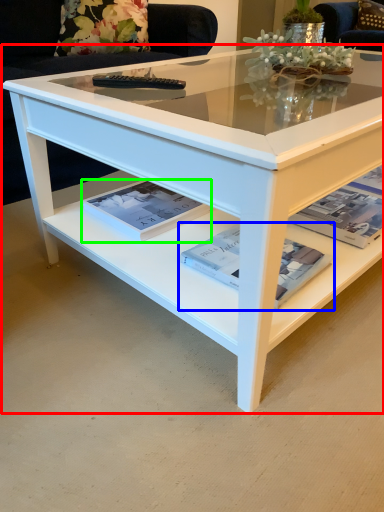
Question: Which object is positioned closest to coffee table (highlighted by a red box)? Select from magazine (highlighted by a blue box) and magazine (highlighted by a green box).

Choices:
 (A) magazine
 (B) magazine

Answer: (B)